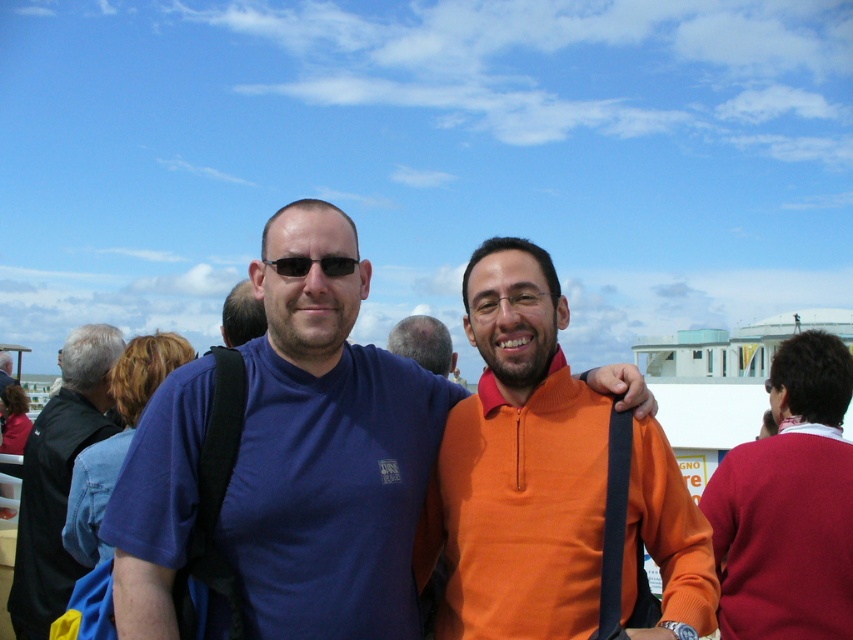
Who is positioned more to the left, orange fleece at center or blue cotton shirt at left?

From the viewer's perspective, blue cotton shirt at left appears more on the left side.

The height and width of the screenshot is (640, 853). In order to click on orange fleece at center in this screenshot , I will do `click(517, 465)`.

Is point (563, 492) positioned in front of point (86, 442)?

Yes, it is in front of point (86, 442).

Locate an element on the screen. The height and width of the screenshot is (640, 853). orange fleece at center is located at coordinates (517, 465).

Who is taller, orange fleece at center or black plastic sunglasses at center?

With more height is orange fleece at center.

Which is more to the left, orange fleece at center or black plastic sunglasses at center?

From the viewer's perspective, black plastic sunglasses at center appears more on the left side.

You are a GUI agent. You are given a task and a screenshot of the screen. Output one action in this format:
    pyautogui.click(x=<x>, y=<y>)
    Task: Click on the orange fleece at center
    This screenshot has height=640, width=853.
    Given the screenshot: What is the action you would take?
    pyautogui.click(x=517, y=465)

Which is behind, point (430, 349) or point (332, 262)?

Point (430, 349)

Who is taller, smooth bald head at center or black plastic sunglasses at center?

smooth bald head at center

What do you see at coordinates (422, 342) in the screenshot? I see `smooth bald head at center` at bounding box center [422, 342].

In order to click on smooth bald head at center in this screenshot , I will do `click(422, 342)`.